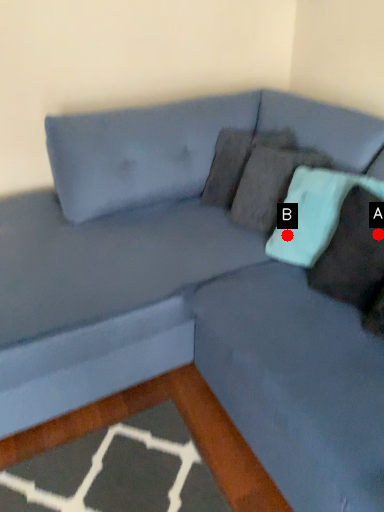
Question: Two points are circled on the image, labeled by A and B beside each circle. Which of the following is the closest to the observer?

Choices:
 (A) A is closer
 (B) B is closer

Answer: (A)